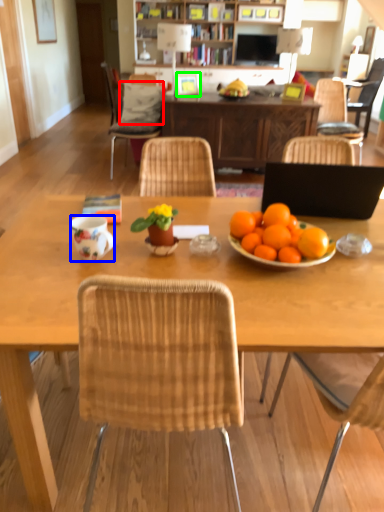
Question: Based on their relative distances, which object is nearer to pillow (highlighted by a red box)? Choose from coffee cup (highlighted by a blue box) and picture frame (highlighted by a green box).

Choices:
 (A) coffee cup
 (B) picture frame

Answer: (B)